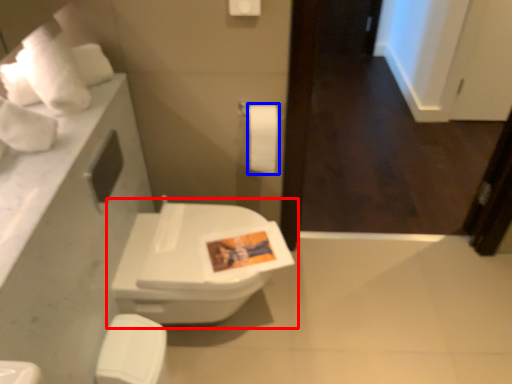
Question: Which object appears farthest to the camera in this image, toilet (highlighted by a red box) or toilet paper (highlighted by a blue box)?

Choices:
 (A) toilet
 (B) toilet paper

Answer: (B)